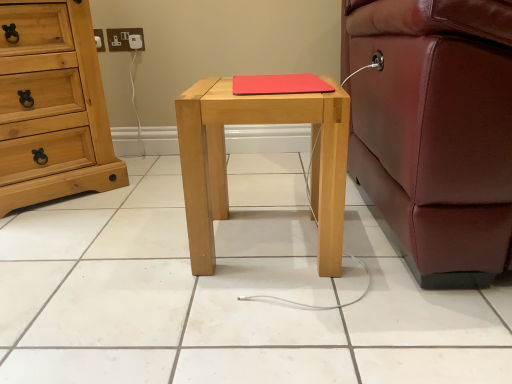
This screenshot has width=512, height=384. What are the coordinates of `free space to the back side of light wood/texture nightstand at center` in the screenshot? It's located at (267, 193).